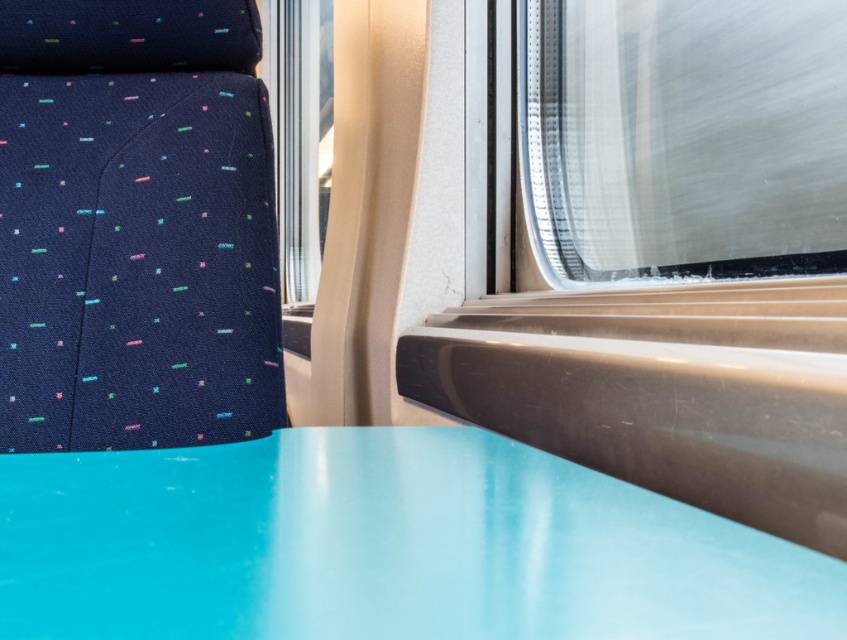
You are a passenger sitting on the dark blue seat with colorful dots. You want to place your phone on the glossy plastic table at center and look out the transparent glass train window at upper right. Can you see the window from where the table is placed?

The glossy plastic table at center is not as tall as the transparent glass train window at upper right, so yes, you can see the window from where the table is placed because the window is taller and likely positioned above the table.

You are sitting in a train carriage and notice a glossy plastic table at center. If you want to place a small notebook on the table, where exactly should you aim based on its coordinates?

The glossy plastic table at center is located at point (x=383, y=547), so you should aim for those coordinates to place the notebook there.

You are a passenger sitting at the glossy plastic table at center in the train. You want to look outside through the transparent glass train window at upper right. Which direction should you turn your head to face the window?

The glossy plastic table at center is positioned on the left side of transparent glass train window at upper right, so you should turn your head to the right to face the window.